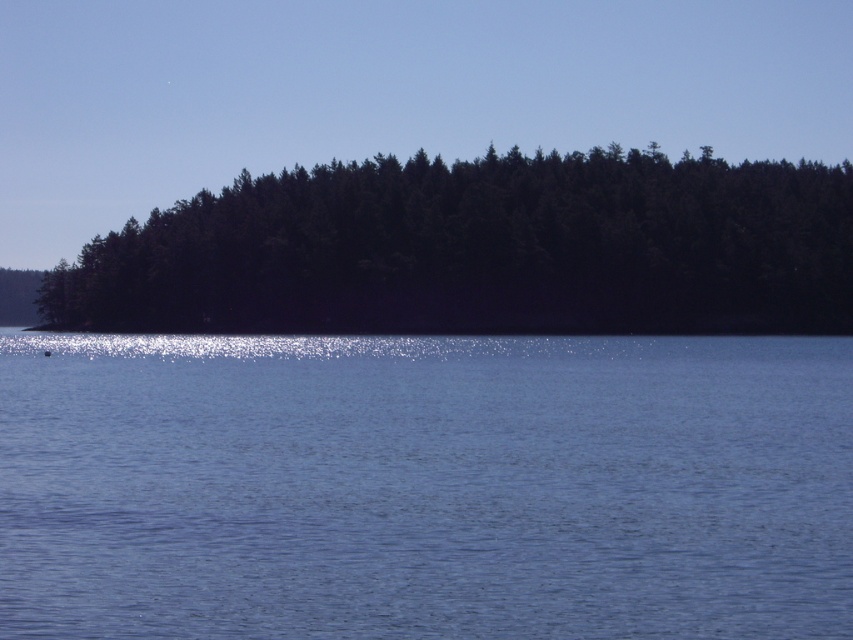
Who is positioned more to the left, blue liquid water at center or dark green forest at center?

Result: blue liquid water at center is more to the left.

Does blue liquid water at center appear on the left side of dark green forest at center?

Correct, you'll find blue liquid water at center to the left of dark green forest at center.

Does point (270, 564) come behind point (502, 246)?

No, (270, 564) is in front of (502, 246).

This screenshot has height=640, width=853. In order to click on blue liquid water at center in this screenshot , I will do `click(424, 486)`.